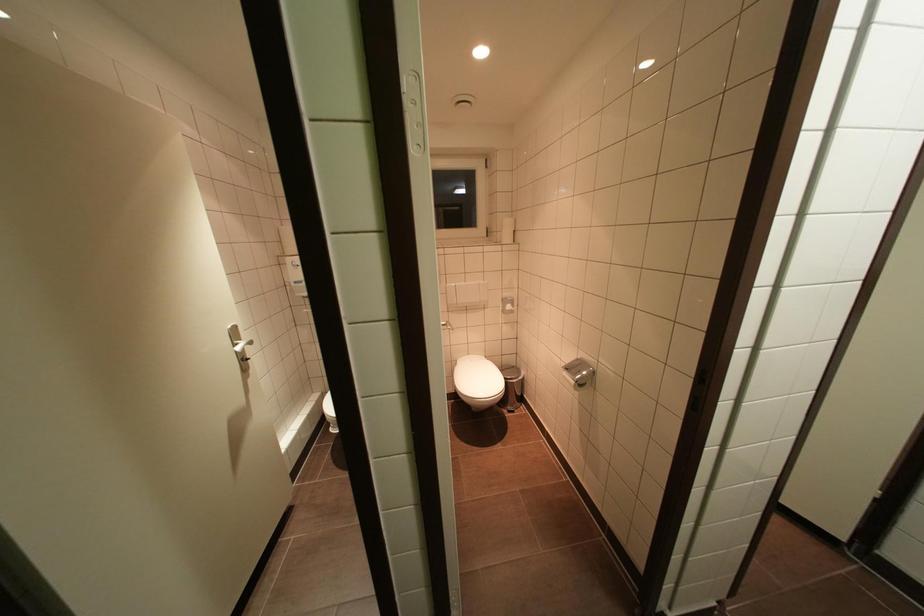
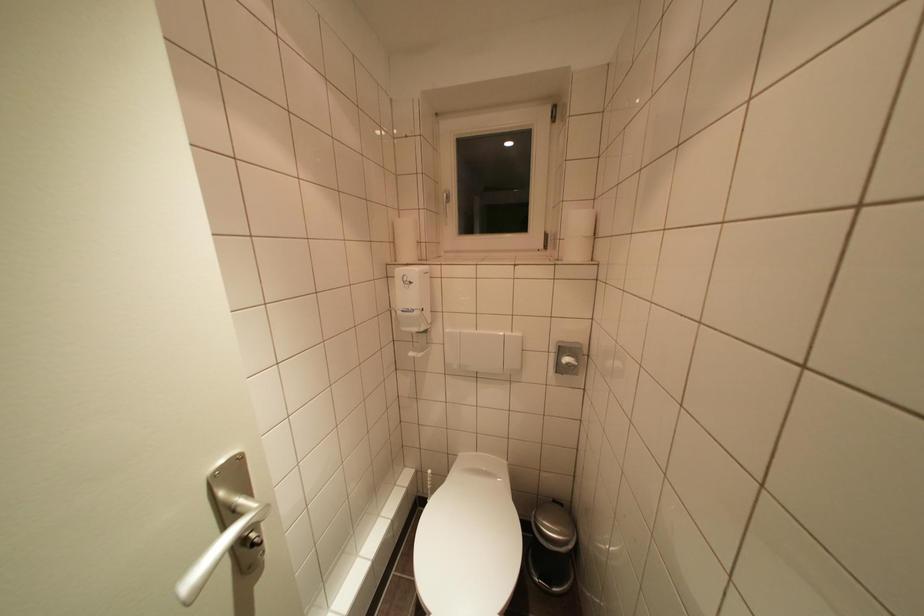
Where in the second image is the point corresponding to point (299, 286) from the first image?

(406, 315)